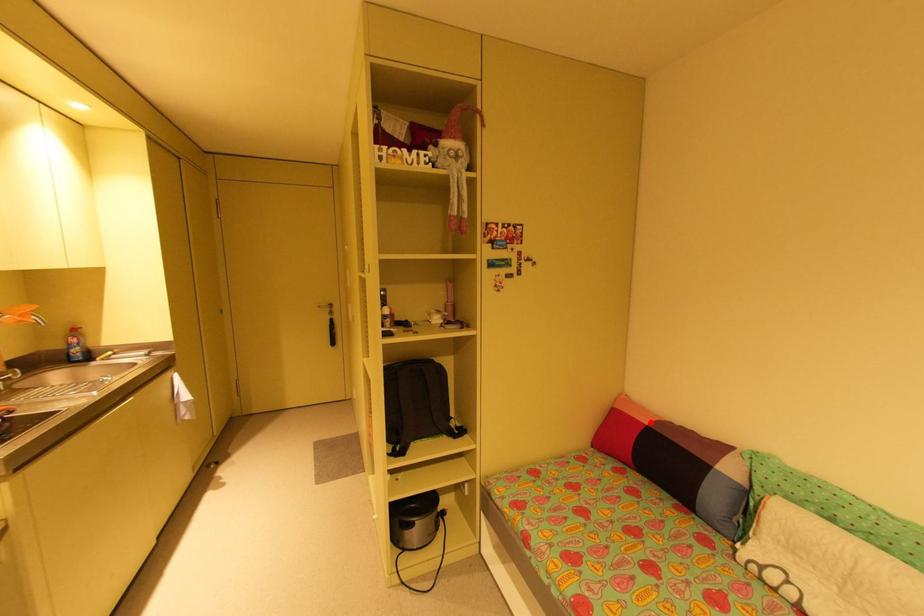
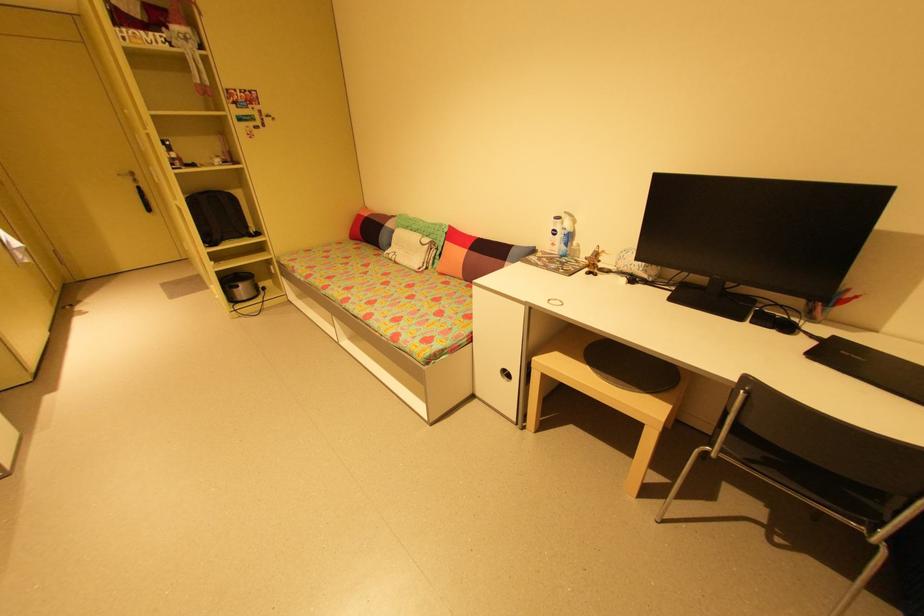
In the second image, find the point that corresponds to the highlighted location in the first image.

(371, 215)